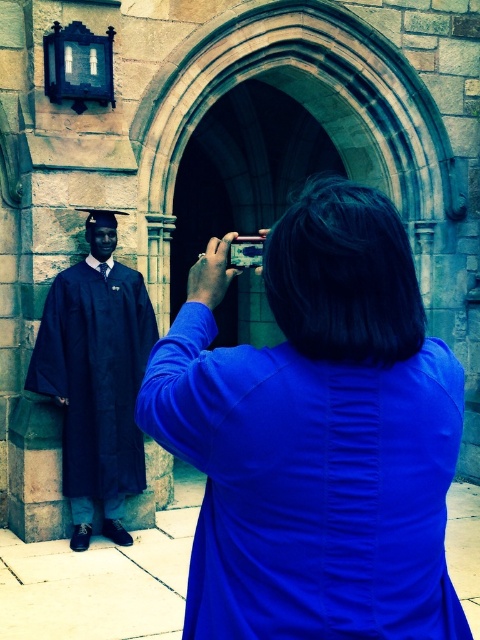
You are a photographer standing at the center of the scene. You need to adjust your position to ensure both the blue fabric shirt at center and the matte black gown at left are in the frame. Given the distance between them, what is the minimum focal length lens you should use to capture both subjects without cropping?

The blue fabric shirt at center and matte black gown at left are 5.78 meters apart. To capture both subjects in the frame without cropping, you should use a wide angle lens with a focal length of 35mm or lower.

You are a fashion designer observing the scene outside the historic stone building. You notice the blue fabric shirt at center and the matte black gown at left. Which garment is shorter in length?

The blue fabric shirt at center is shorter than the matte black gown at left.

Based on the photo, you are standing at the point marked as point (418, 556) and want to take a photo of the archway. The camera is 3.48 meters away from you. Can you reach the camera to take the photo?

The camera is 3.48 meters away from point (418, 556), so you can reach it to take the photo since the distance is manageable for a person to move and hold the camera.